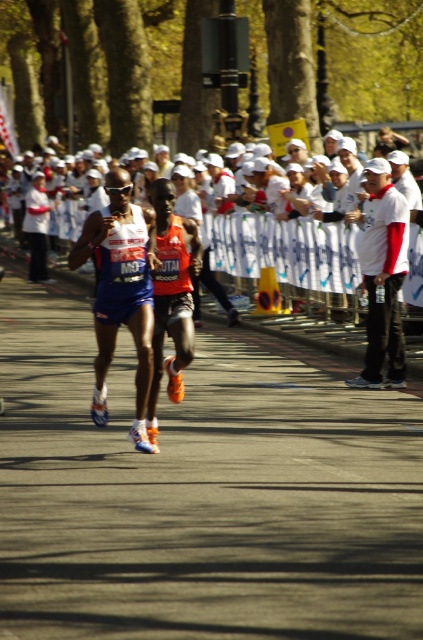
You are a photographer positioned at the origin point of the image. You want to capture the blue fabric running suit at center in your shot. What are the coordinates where you should focus your camera?

Answer: The blue fabric running suit at center is located at coordinates (120, 291), so you should focus your camera there.